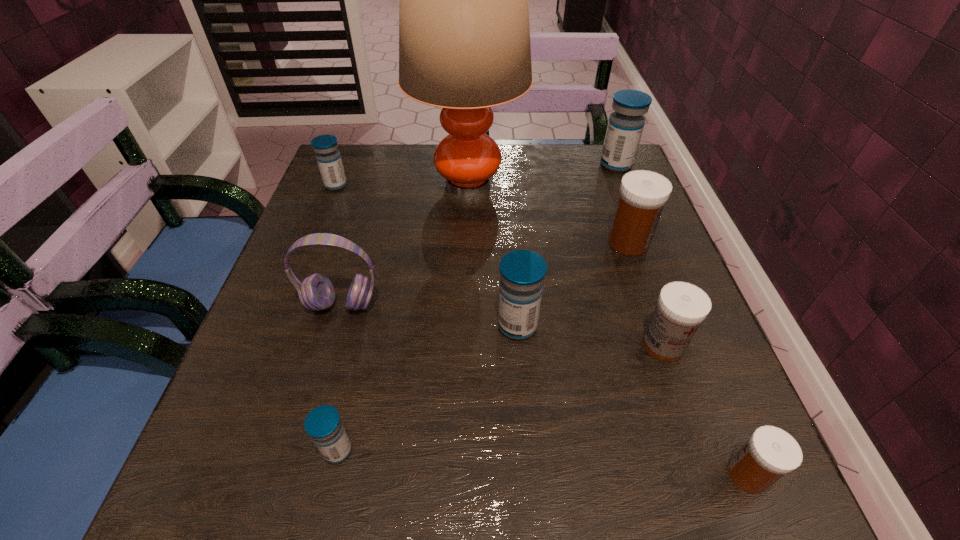
Identify the location of the tallest object. Image resolution: width=960 pixels, height=540 pixels. (464, 37).

Image resolution: width=960 pixels, height=540 pixels. In order to click on lamp in this screenshot , I will do `click(464, 37)`.

Where is `the farthest blue medicine`? This screenshot has height=540, width=960. the farthest blue medicine is located at coordinates (625, 126).

Locate an element on the screen. Image resolution: width=960 pixels, height=540 pixels. the rightmost blue medicine is located at coordinates (625, 126).

The height and width of the screenshot is (540, 960). I want to click on headset, so click(316, 292).

Find the location of a particular element. This screenshot has height=540, width=960. the biggest white medicine is located at coordinates (643, 194).

Image resolution: width=960 pixels, height=540 pixels. I want to click on the fifth nearest medicine, so click(x=643, y=194).

You are a GUI agent. You are given a task and a screenshot of the screen. Output one action in this format:
    pyautogui.click(x=<x>, y=<y>)
    Task: Click on the second biggest blue medicine
    
    Given the screenshot: What is the action you would take?
    pyautogui.click(x=522, y=272)

The height and width of the screenshot is (540, 960). In order to click on the third farthest blue medicine in this screenshot , I will do tap(522, 272).

The image size is (960, 540). In order to click on the second smallest blue medicine in this screenshot , I will do `click(328, 157)`.